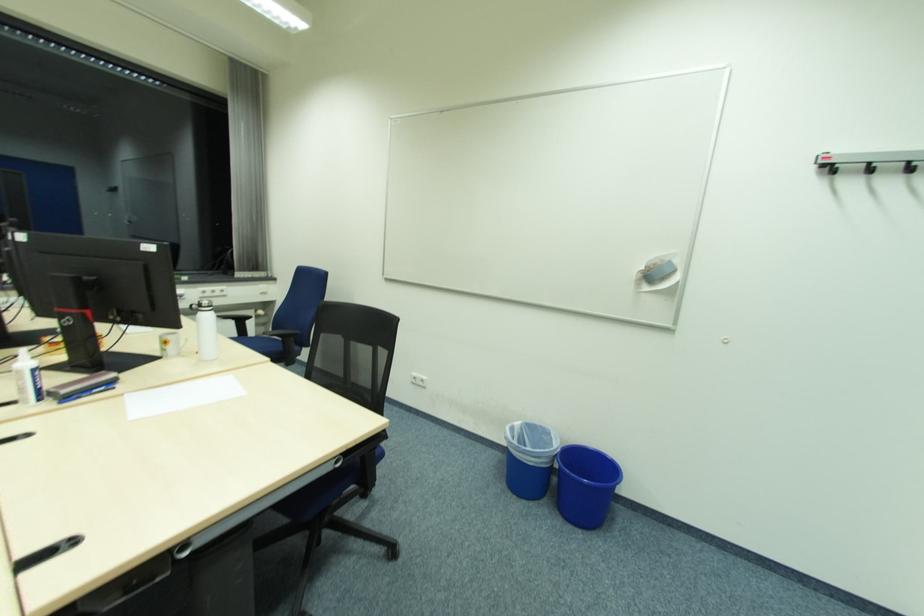
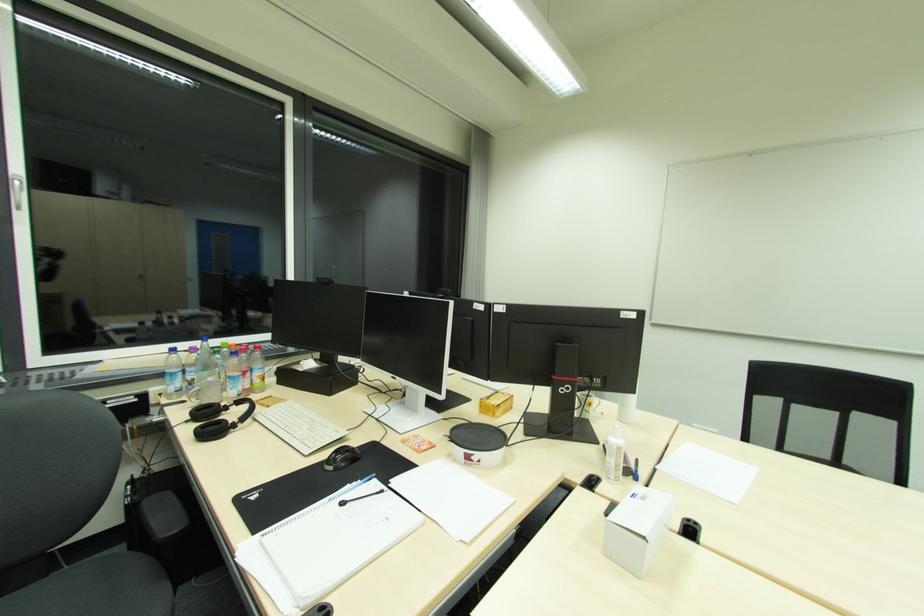
Question: In a continuous first-person perspective shot, in which direction is the camera moving?

Choices:
 (A) Left
 (B) Right
 (C) Forward
 (D) Backward

Answer: (A)